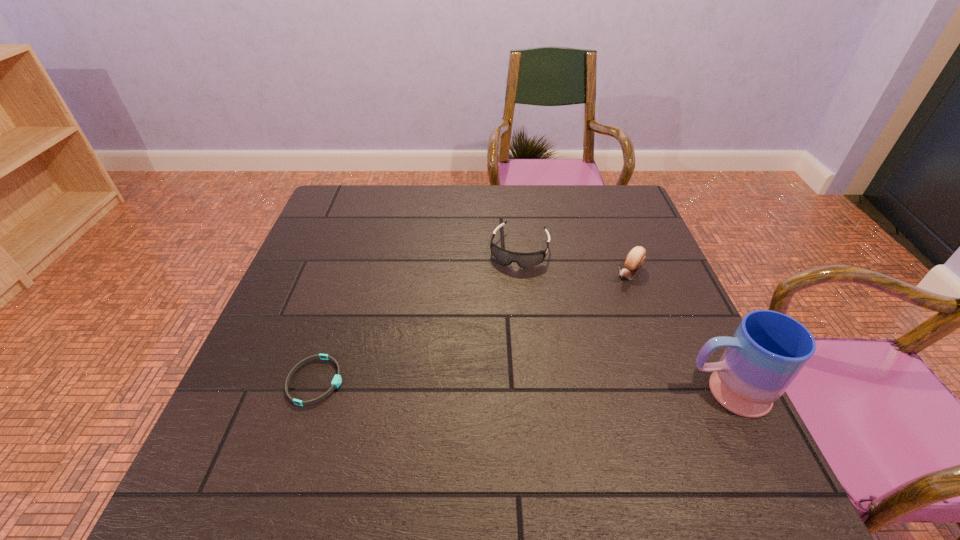
The width and height of the screenshot is (960, 540). I want to click on vacant space situated on the front-facing side of the third shortest object, so click(x=567, y=340).

At what (x,y) coordinates should I click in order to perform the action: click on free region located on the front-facing side of the third shortest object. Please return your answer as a coordinate pair (x, y). This screenshot has height=540, width=960. Looking at the image, I should click on (611, 294).

Where is `free space located 0.390m on the front-facing side of the third shortest object`? The width and height of the screenshot is (960, 540). free space located 0.390m on the front-facing side of the third shortest object is located at coordinates (530, 379).

You are a GUI agent. You are given a task and a screenshot of the screen. Output one action in this format:
    pyautogui.click(x=<x>, y=<y>)
    Task: Click on the vacant area situated 0.090m on the front and sides of the goggles
    
    Given the screenshot: What is the action you would take?
    pyautogui.click(x=507, y=293)

I want to click on vacant space located 0.070m on the front and sides of the goggles, so click(509, 287).

The image size is (960, 540). I want to click on vacant space located 0.400m on the front and sides of the goggles, so click(476, 396).

Find the location of `wristband located at the near edge`. wristband located at the near edge is located at coordinates (337, 379).

Locate an element on the screen. Image resolution: width=960 pixels, height=540 pixels. mug located in the near edge section of the desktop is located at coordinates (768, 350).

Image resolution: width=960 pixels, height=540 pixels. Identify the location of object located at the left edge. (337, 379).

Image resolution: width=960 pixels, height=540 pixels. What are the coordinates of `mug that is at the right edge` in the screenshot? It's located at (768, 350).